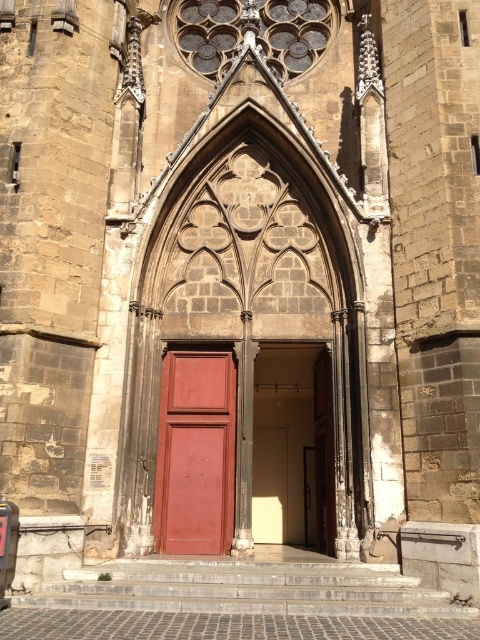
You are a painter hired to paint both doors in the entrance of a Gothic building. You have enough paint to cover 2 square meters. The smooth cream door at center and the matte wood door at center need to be painted. Which door requires more paint?

The smooth cream door at center requires more paint because it has a larger size compared to the matte wood door at center, so it needs more paint to cover its surface.